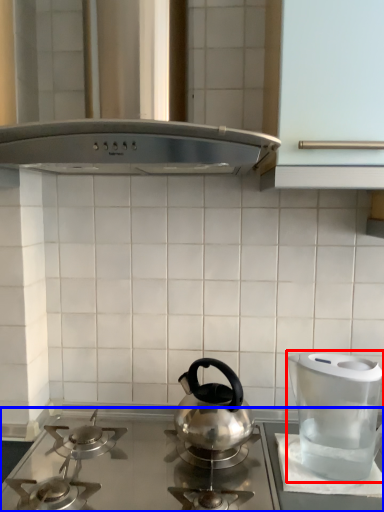
Question: Which point is closer to the camera, kitchen appliance (highlighted by a red box) or gas stove (highlighted by a blue box)?

Choices:
 (A) kitchen appliance
 (B) gas stove

Answer: (B)